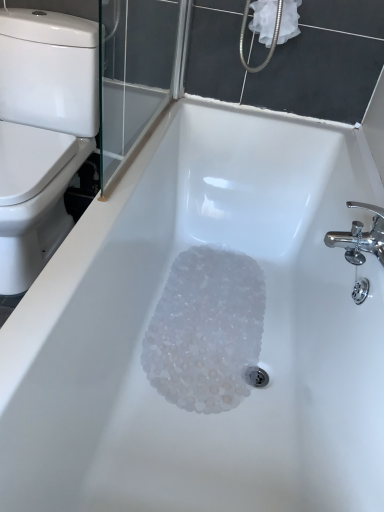
This screenshot has width=384, height=512. In order to click on translucent plastic crystals at bottom in this screenshot , I will do `click(206, 330)`.

Measure the distance between point [265,24] and camera.

Point [265,24] and camera are 4.34 feet apart.

Image resolution: width=384 pixels, height=512 pixels. Describe the element at coordinates (264, 20) in the screenshot. I see `white fabric at upper right` at that location.

The image size is (384, 512). I want to click on translucent plastic crystals at bottom, so click(206, 330).

What's the angular difference between white fabric at upper right and white glossy toilet at left's facing directions?

The facing directions of white fabric at upper right and white glossy toilet at left are 1.43 degrees apart.

Is white fabric at upper right to the left or to the right of white glossy toilet at left in the image?

In the image, white fabric at upper right appears on the right side of white glossy toilet at left.

Considering the relative sizes of white fabric at upper right and white glossy toilet at left in the image provided, is white fabric at upper right wider than white glossy toilet at left?

No.

From their relative heights in the image, would you say white fabric at upper right is taller or shorter than white glossy toilet at left?

In the image, white fabric at upper right appears to be shorter than white glossy toilet at left.

Is translucent plastic crystals at bottom wider or thinner than white glossy toilet at left?

In the image, translucent plastic crystals at bottom appears to be more narrow than white glossy toilet at left.

Considering the relative sizes of translucent plastic crystals at bottom and white glossy toilet at left in the image provided, is translucent plastic crystals at bottom smaller than white glossy toilet at left?

Correct, translucent plastic crystals at bottom occupies less space than white glossy toilet at left.

Which is closer to the camera, (x=227, y=310) or (x=71, y=146)?

Point (x=227, y=310) is positioned closer to the camera compared to point (x=71, y=146).

Are translucent plastic crystals at bottom and white glossy toilet at left far apart?

No, there isn't a large distance between translucent plastic crystals at bottom and white glossy toilet at left.

Which of these two, translucent plastic crystals at bottom or white fabric at upper right, is smaller?

white fabric at upper right is smaller.

You are a GUI agent. You are given a task and a screenshot of the screen. Output one action in this format:
    pyautogui.click(x=<x>, y=<y>)
    Task: Click on the crystal on the left of white fabric at upper right
    This screenshot has height=512, width=384.
    Given the screenshot: What is the action you would take?
    pyautogui.click(x=206, y=330)

From the image's perspective, relative to white fabric at upper right, is translucent plastic crystals at bottom above or below?

translucent plastic crystals at bottom is situated lower than white fabric at upper right in the image.

Is white fabric at upper right at the back of translucent plastic crystals at bottom?

No, white fabric at upper right is not at the back of translucent plastic crystals at bottom.

The image size is (384, 512). I want to click on crystal below the white glossy toilet at left (from a real-world perspective), so click(x=206, y=330).

Considering the relative sizes of white glossy toilet at left and translucent plastic crystals at bottom in the image provided, is white glossy toilet at left shorter than translucent plastic crystals at bottom?

No, white glossy toilet at left is not shorter than translucent plastic crystals at bottom.

Does white glossy toilet at left turn towards translucent plastic crystals at bottom?

No, white glossy toilet at left does not turn towards translucent plastic crystals at bottom.

Between white glossy toilet at left and translucent plastic crystals at bottom, which one has larger width?

Wider between the two is white glossy toilet at left.

How many degrees apart are the facing directions of white glossy toilet at left and white fabric at upper right?

1.43 degrees separate the facing orientations of white glossy toilet at left and white fabric at upper right.

From the image's perspective, is white glossy toilet at left above or below white fabric at upper right?

Clearly, from the image's perspective, white glossy toilet at left is below white fabric at upper right.

From a real-world perspective, is white glossy toilet at left on white fabric at upper right?

Incorrect, from a real-world perspective, white glossy toilet at left is lower than white fabric at upper right.

Is white glossy toilet at left oriented towards white fabric at upper right?

No, white glossy toilet at left is not turned towards white fabric at upper right.

Can you tell me how much white fabric at upper right and translucent plastic crystals at bottom differ in facing direction?

The angle between the facing direction of white fabric at upper right and the facing direction of translucent plastic crystals at bottom is 88.9 degrees.

Based on the photo, in terms of height, does white fabric at upper right look taller or shorter compared to translucent plastic crystals at bottom?

In the image, white fabric at upper right appears to be taller than translucent plastic crystals at bottom.

Is white fabric at upper right beside translucent plastic crystals at bottom?

They are not placed beside each other.

Locate an element on the screen. The image size is (384, 512). toilet paper above the white glossy toilet at left (from the image's perspective) is located at coordinates (264, 20).

Identify the location of bidet located above the translucent plastic crystals at bottom (from a real-world perspective). This screenshot has height=512, width=384. (34, 199).

Considering their positions, is white fabric at upper right positioned closer to translucent plastic crystals at bottom than white glossy toilet at left?

white glossy toilet at left is closer to translucent plastic crystals at bottom.

From the image, which object appears to be nearer to translucent plastic crystals at bottom, white glossy toilet at left or white fabric at upper right?

white glossy toilet at left is closer to translucent plastic crystals at bottom.

Looking at the image, which one is located further to white fabric at upper right, translucent plastic crystals at bottom or white glossy toilet at left?

The object further to white fabric at upper right is translucent plastic crystals at bottom.

Which object lies further to the anchor point white fabric at upper right, white glossy toilet at left or translucent plastic crystals at bottom?

translucent plastic crystals at bottom lies further to white fabric at upper right than the other object.

When comparing their distances from white glossy toilet at left, does white fabric at upper right or translucent plastic crystals at bottom seem further?

Among the two, white fabric at upper right is located further to white glossy toilet at left.

Based on their spatial positions, is translucent plastic crystals at bottom or white fabric at upper right closer to white glossy toilet at left?

translucent plastic crystals at bottom is closer to white glossy toilet at left.

At what (x,y) coordinates should I click in order to perform the action: click on bidet between white fabric at upper right and translucent plastic crystals at bottom in the vertical direction. Please return your answer as a coordinate pair (x, y). Image resolution: width=384 pixels, height=512 pixels. Looking at the image, I should click on (34, 199).